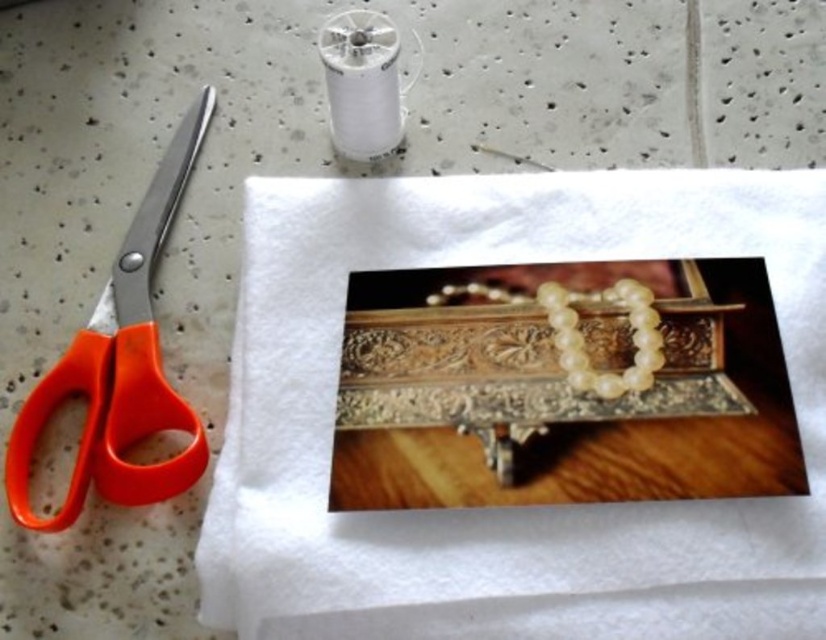
Is white fabric at center smaller than orange plastic scissors at left?

Actually, white fabric at center might be larger than orange plastic scissors at left.

Is white fabric at center behind orange plastic scissors at left?

No, it is not.

Locate an element on the screen. This screenshot has height=640, width=826. white fabric at center is located at coordinates (501, 508).